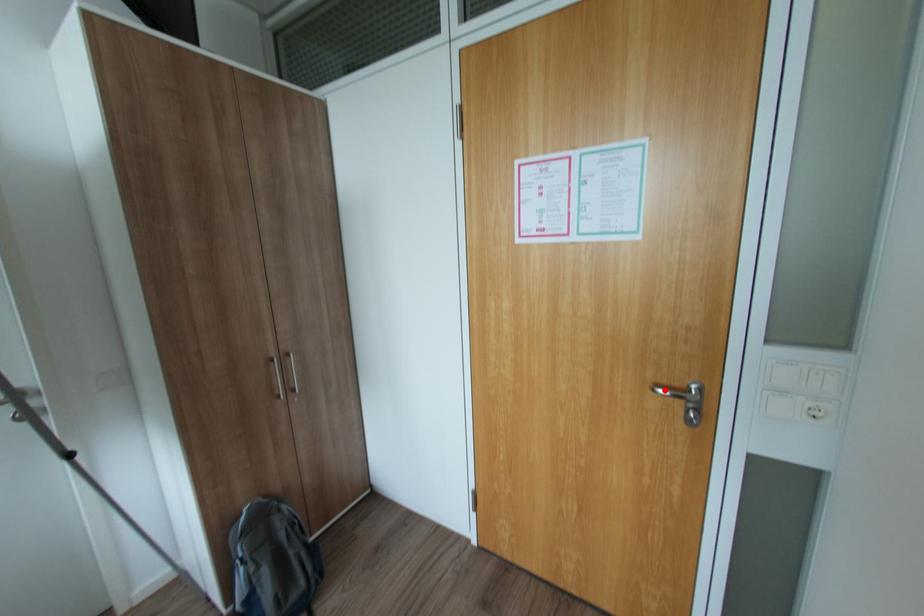
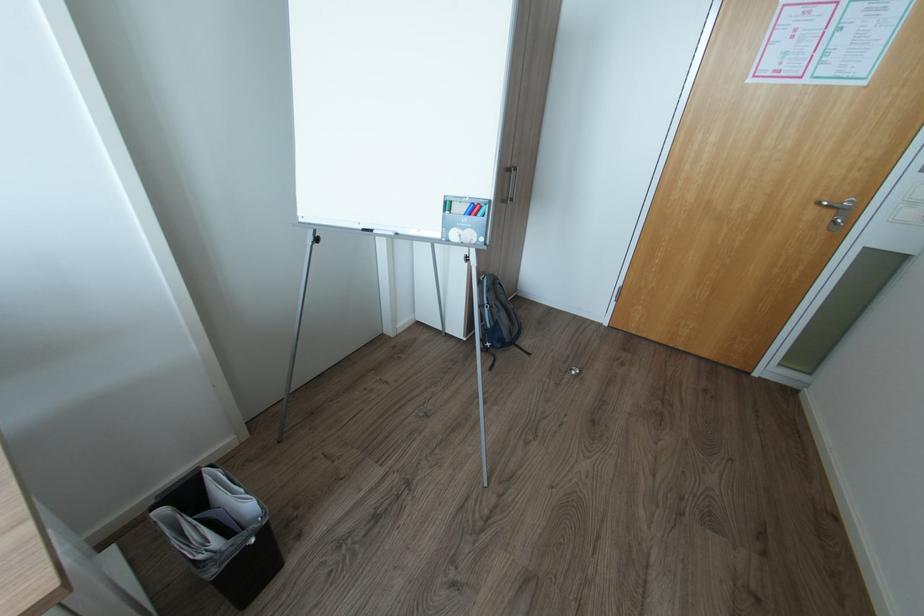
Where in the second image is the point corresponding to the highlighted location from the first image?

(830, 204)